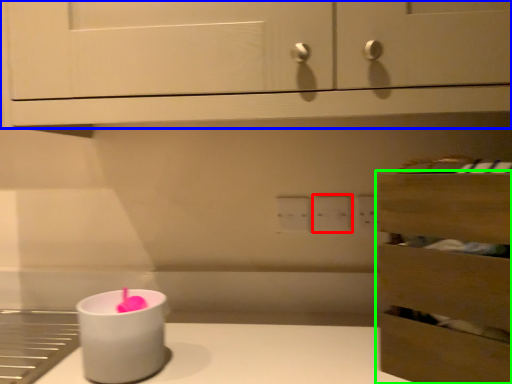
Question: Estimate the real-world distances between objects in this image. Which object is farther from electric outlet (highlighted by a red box), cabinetry (highlighted by a blue box) or drawer (highlighted by a green box)?

Choices:
 (A) cabinetry
 (B) drawer

Answer: (A)